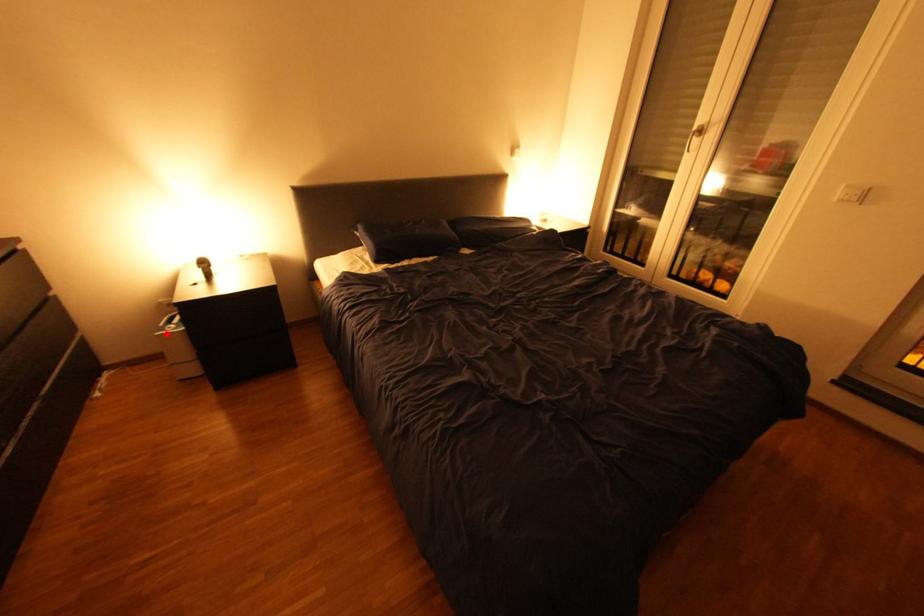
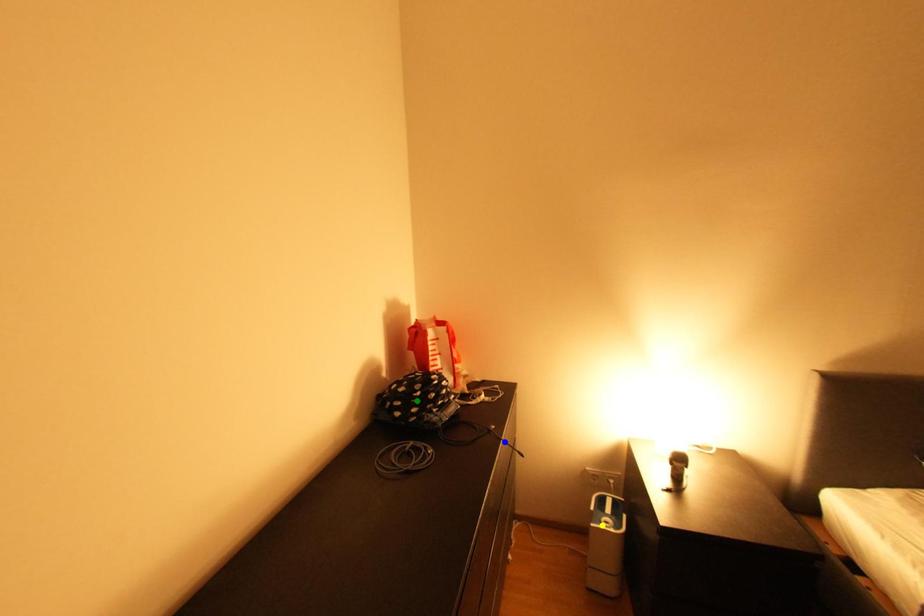
Question: I am providing you with two images of the same scene from different viewpoints. A red point is marked on the first image. You are given multiple points on the second image. Which spot in image 2 lines up with the point in image 1?

Choices:
 (A) green point
 (B) yellow point
 (C) blue point

Answer: (B)